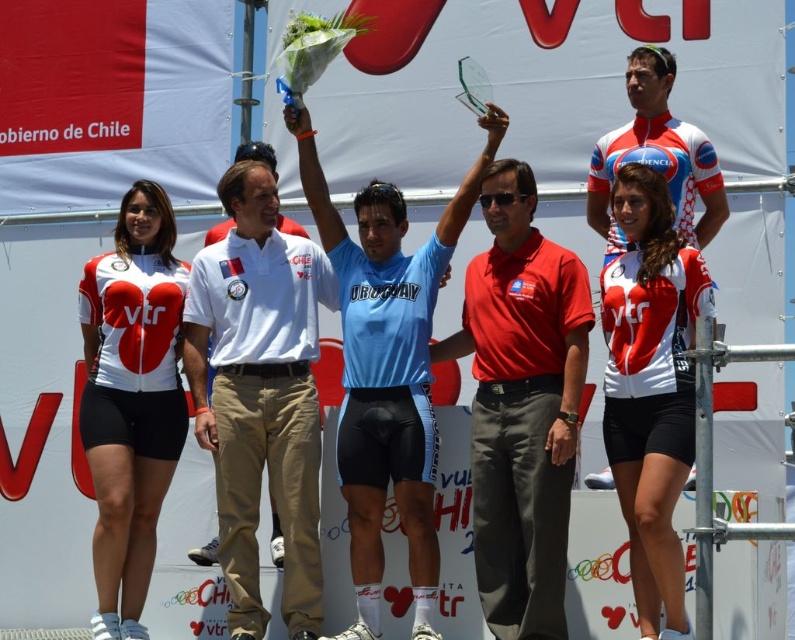
Question: Which object is closer to the camera taking this photo?

Choices:
 (A) white matte jersey at left
 (B) matte white jersey at center

Answer: (B)

Question: Is white cotton polo shirt at center positioned in front of light blue jersey at center?

Choices:
 (A) no
 (B) yes

Answer: (A)

Question: Considering the relative positions of white cotton polo shirt at center and white jersey at upper right in the image provided, where is white cotton polo shirt at center located with respect to white jersey at upper right?

Choices:
 (A) above
 (B) below

Answer: (B)

Question: Which is nearer to the light blue jersey at center?

Choices:
 (A) white jersey at upper right
 (B) matte white jersey at center

Answer: (A)

Question: Which of the following is the closest to the observer?

Choices:
 (A) light blue jersey at center
 (B) white jersey at upper right
 (C) matte white jersey at center

Answer: (C)

Question: Does red cotton polo shirt at center have a lesser width compared to white matte jersey at left?

Choices:
 (A) yes
 (B) no

Answer: (B)